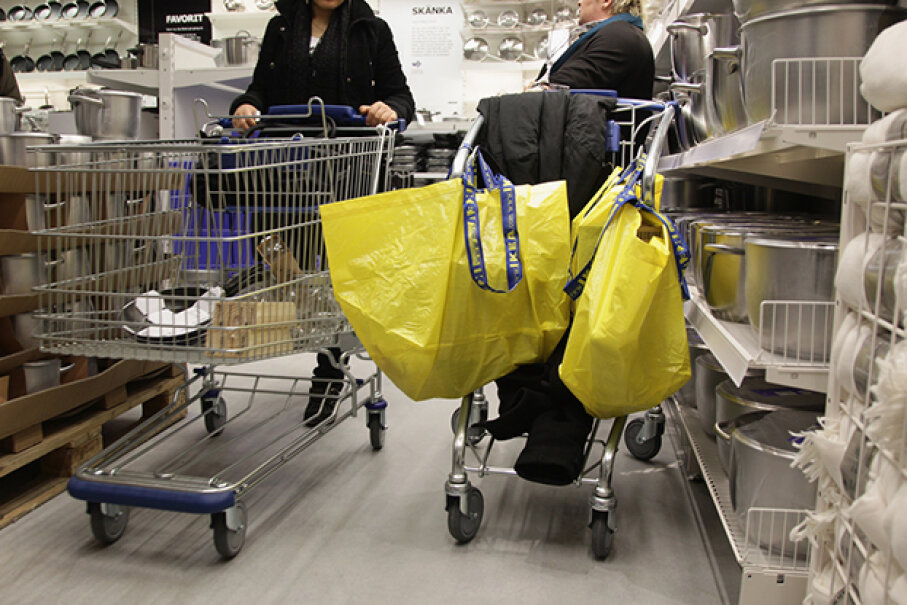
Locate an element on the screen. rolled up throw blankets is located at coordinates (846, 360), (850, 267), (861, 163), (892, 74), (830, 457), (872, 584), (818, 595).